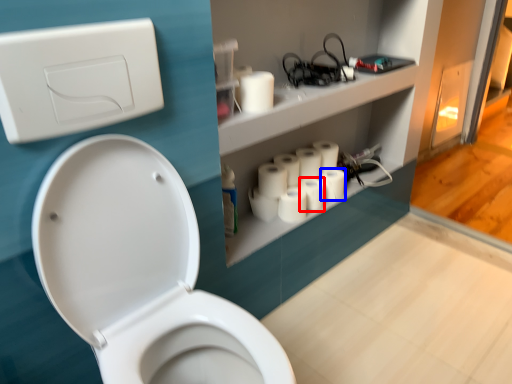
Question: Which of the following is the closest to the observer, toilet paper (highlighted by a red box) or toilet paper (highlighted by a blue box)?

Choices:
 (A) toilet paper
 (B) toilet paper

Answer: (A)